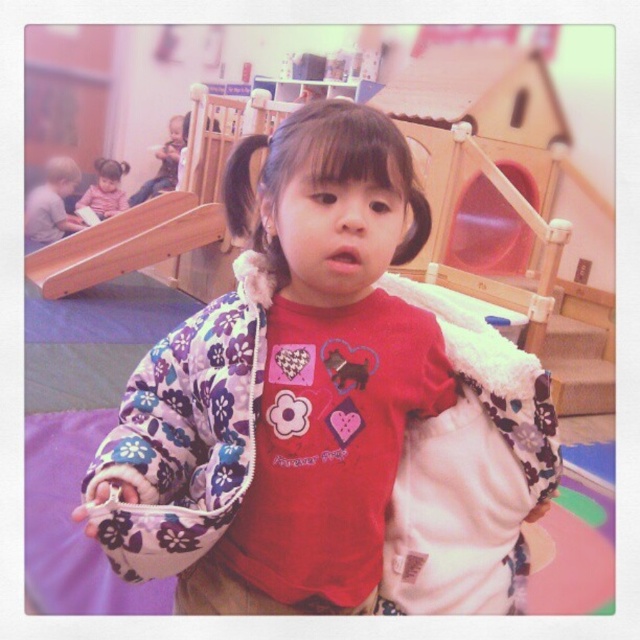
Does fluffy fleece jacket at center appear under black silky hair at center?

Correct, fluffy fleece jacket at center is located below black silky hair at center.

Is fluffy fleece jacket at center further to camera compared to black silky hair at center?

No, fluffy fleece jacket at center is in front of black silky hair at center.

Image resolution: width=640 pixels, height=640 pixels. In order to click on fluffy fleece jacket at center in this screenshot , I will do `click(326, 372)`.

Where is `fluffy fleece jacket at center`? This screenshot has height=640, width=640. fluffy fleece jacket at center is located at coordinates (326, 372).

Can you confirm if fluffy fleece jacket at center is thinner than wooden playhouse at upper center?

Indeed, fluffy fleece jacket at center has a lesser width compared to wooden playhouse at upper center.

Is fluffy fleece jacket at center to the left of wooden playhouse at upper center from the viewer's perspective?

Yes, fluffy fleece jacket at center is to the left of wooden playhouse at upper center.

You are a GUI agent. You are given a task and a screenshot of the screen. Output one action in this format:
    pyautogui.click(x=<x>, y=<y>)
    Task: Click on the fluffy fleece jacket at center
    The height and width of the screenshot is (640, 640).
    Given the screenshot: What is the action you would take?
    pyautogui.click(x=326, y=372)

Does point (285, 577) come in front of point (90, 276)?

Yes.

You are a GUI agent. You are given a task and a screenshot of the screen. Output one action in this format:
    pyautogui.click(x=<x>, y=<y>)
    Task: Click on the fluffy fleece jacket at center
    The width and height of the screenshot is (640, 640).
    Given the screenshot: What is the action you would take?
    pyautogui.click(x=326, y=372)